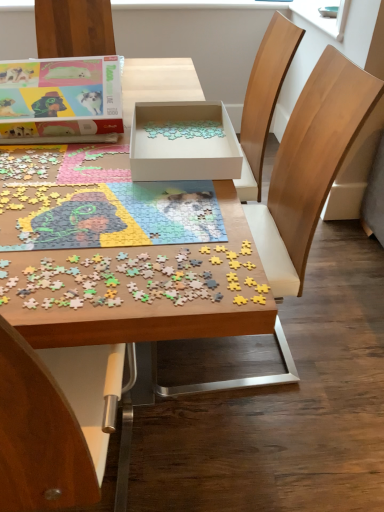
Find the location of `vacant space situated above wooden puzzle pieces at center, which is counted as the second jigsaw puzzle, starting from the top (from a real-world perspective)`. vacant space situated above wooden puzzle pieces at center, which is counted as the second jigsaw puzzle, starting from the top (from a real-world perspective) is located at coordinates (105, 267).